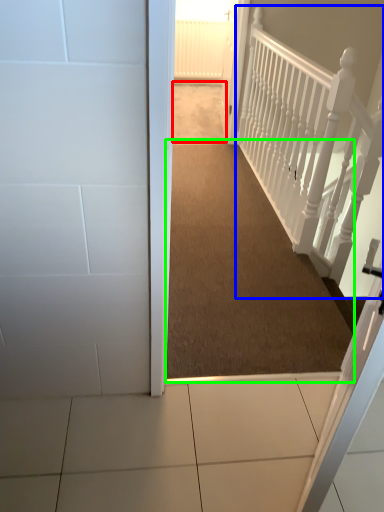
Question: Which is farther away from path (highlighted by a red box)? rail (highlighted by a blue box) or corridor (highlighted by a green box)?

Choices:
 (A) rail
 (B) corridor

Answer: (B)